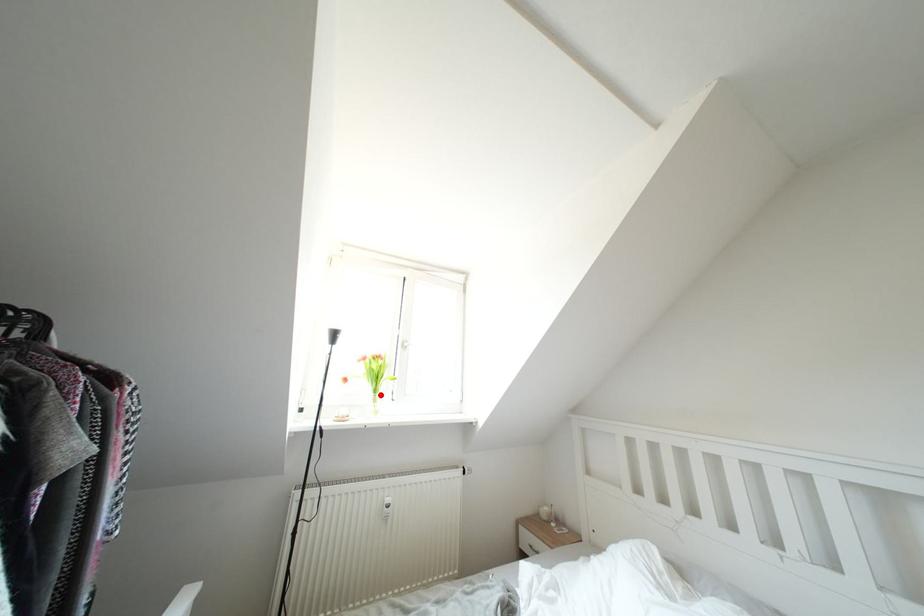
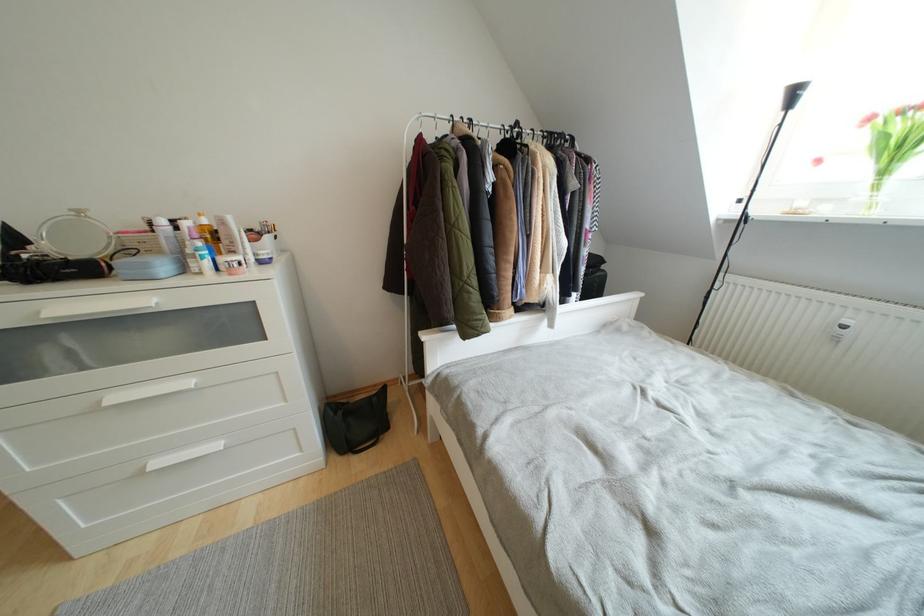
Question: I am providing you with two images of the same scene from different viewpoints. A red point is marked on the first image. Can you still see the location of the red point in image 2?

Choices:
 (A) Yes
 (B) No

Answer: (A)